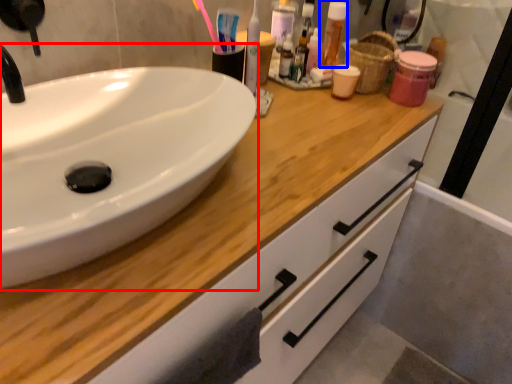
Question: Which of the following is the farthest to the observer, sink (highlighted by a red box) or mouthwash (highlighted by a blue box)?

Choices:
 (A) sink
 (B) mouthwash

Answer: (B)